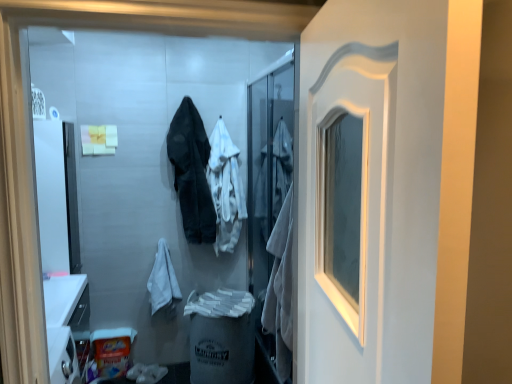
Image resolution: width=512 pixels, height=384 pixels. Find the location of `dark gray fabric coat at center, positioned as the first clothing in left-to-right order`. dark gray fabric coat at center, positioned as the first clothing in left-to-right order is located at coordinates (192, 172).

At what (x,y) coordinates should I click in order to perform the action: click on white matte screen door at center. Please return your answer as a coordinate pair (x, y). Looking at the image, I should click on (270, 205).

The height and width of the screenshot is (384, 512). I want to click on white cotton bathrobe at lower left, so click(x=163, y=282).

You are a GUI agent. You are given a task and a screenshot of the screen. Output one action in this format:
    pyautogui.click(x=<x>, y=<y>)
    Task: Click on the white cotton hoodie at center, the 2th clothing from the left
    This screenshot has height=384, width=512.
    Given the screenshot: What is the action you would take?
    pyautogui.click(x=225, y=188)

Which object is more forward, white cotton bathrobe at lower left or white matte screen door at center?

white matte screen door at center is more forward.

Does point (166, 245) come closer to viewer compared to point (278, 257)?

No, (166, 245) is further to viewer.

Is white cotton bathrobe at lower left completely or partially outside of white matte screen door at center?

white cotton bathrobe at lower left lies outside white matte screen door at center's area.

How different are the orientations of white cotton bathrobe at lower left and white matte screen door at center in degrees?

white cotton bathrobe at lower left and white matte screen door at center are facing 93.5 degrees away from each other.

Does white cotton hoodie at center, the first clothing when ordered from right to left, have a lesser height compared to white cotton bathrobe at lower left?

No, white cotton hoodie at center, the first clothing when ordered from right to left, is not shorter than white cotton bathrobe at lower left.

Is white cotton hoodie at center, the 2th clothing from the left, far from white cotton bathrobe at lower left?

Actually, white cotton hoodie at center, the 2th clothing from the left, and white cotton bathrobe at lower left are a little close together.

From a real-world perspective, which is physically above, white cotton hoodie at center, the first clothing when ordered from right to left, or white cotton bathrobe at lower left?

white cotton hoodie at center, the first clothing when ordered from right to left, is physically above.

From the image's perspective, is white glossy door at center over white cotton hoodie at center, the first clothing when ordered from right to left?

No, from the image's perspective, white glossy door at center is not on top of white cotton hoodie at center, the first clothing when ordered from right to left.

Is white glossy door at center oriented towards white cotton hoodie at center, the 2th clothing from the left?

No, white glossy door at center is not facing towards white cotton hoodie at center, the 2th clothing from the left.

Does white glossy door at center contain white cotton hoodie at center, the 2th clothing from the left?

No, white cotton hoodie at center, the 2th clothing from the left, is not surrounded by white glossy door at center.

Considering the sizes of objects white glossy door at center and white cotton hoodie at center, the 2th clothing from the left, in the image provided, who is thinner, white glossy door at center or white cotton hoodie at center, the 2th clothing from the left,?

white glossy door at center.

Considering the sizes of dark gray fabric coat at center, positioned as the first clothing in left-to-right order, and white glossy door at center in the image, is dark gray fabric coat at center, positioned as the first clothing in left-to-right order, bigger or smaller than white glossy door at center?

Clearly, dark gray fabric coat at center, positioned as the first clothing in left-to-right order, is larger in size than white glossy door at center.

Is dark gray fabric coat at center, the second clothing positioned from the right, inside or outside of white glossy door at center?

dark gray fabric coat at center, the second clothing positioned from the right, cannot be found inside white glossy door at center.

Is dark gray fabric coat at center, the second clothing positioned from the right, shorter than white glossy door at center?

Yes, dark gray fabric coat at center, the second clothing positioned from the right, is shorter than white glossy door at center.

Looking at their sizes, would you say dark gray fabric coat at center, positioned as the first clothing in left-to-right order, is wider or thinner than white glossy door at center?

Considering their sizes, dark gray fabric coat at center, positioned as the first clothing in left-to-right order, looks broader than white glossy door at center.

Is white cotton bathrobe at lower left taller than white cotton hoodie at center, the 2th clothing from the left?

No.

Based on their positions, is white cotton bathrobe at lower left located to the left or right of white cotton hoodie at center, the 2th clothing from the left?

From the image, it's evident that white cotton bathrobe at lower left is to the left of white cotton hoodie at center, the 2th clothing from the left.

Is white cotton bathrobe at lower left oriented towards white cotton hoodie at center, the first clothing when ordered from right to left?

No.

From a real-world perspective, who is located lower, white cotton bathrobe at lower left or white cotton hoodie at center, the first clothing when ordered from right to left?

white cotton bathrobe at lower left.

Between white cotton hoodie at center, the 2th clothing from the left, and white matte screen door at center, which one has smaller size?

With smaller size is white cotton hoodie at center, the 2th clothing from the left.

How far apart are white cotton hoodie at center, the 2th clothing from the left, and white matte screen door at center?

A distance of 16.10 inches exists between white cotton hoodie at center, the 2th clothing from the left, and white matte screen door at center.

Considering the relative positions of white cotton hoodie at center, the first clothing when ordered from right to left, and white matte screen door at center in the image provided, is white cotton hoodie at center, the first clothing when ordered from right to left, behind white matte screen door at center?

Yes, the depth of white cotton hoodie at center, the first clothing when ordered from right to left, is greater than that of white matte screen door at center.

Considering the positions of objects white cotton hoodie at center, the first clothing when ordered from right to left, and white matte screen door at center in the image provided, who is more to the right, white cotton hoodie at center, the first clothing when ordered from right to left, or white matte screen door at center?

white matte screen door at center is more to the right.

Is white matte screen door at center not close to dark gray fabric coat at center, the second clothing positioned from the right?

white matte screen door at center is near dark gray fabric coat at center, the second clothing positioned from the right, not far away.

Image resolution: width=512 pixels, height=384 pixels. I want to click on screen door on the right of dark gray fabric coat at center, positioned as the first clothing in left-to-right order, so click(x=270, y=205).

From a real-world perspective, which is physically below, white matte screen door at center or dark gray fabric coat at center, positioned as the first clothing in left-to-right order?

From a 3D spatial view, white matte screen door at center is below.

The width and height of the screenshot is (512, 384). I want to click on bathrobe located underneath the white matte screen door at center (from a real-world perspective), so click(163, 282).

Identify the location of bathrobe below the white cotton hoodie at center, the 2th clothing from the left (from the image's perspective). (163, 282).

Estimate the real-world distances between objects in this image. Which object is closer to white cotton bathrobe at lower left, white matte screen door at center or white cotton hoodie at center, the 2th clothing from the left?

Based on the image, white cotton hoodie at center, the 2th clothing from the left, appears to be nearer to white cotton bathrobe at lower left.

From the image, which object appears to be farther from white cotton hoodie at center, the first clothing when ordered from right to left, white cotton bathrobe at lower left or dark gray fabric coat at center, positioned as the first clothing in left-to-right order?

Based on the image, white cotton bathrobe at lower left appears to be further to white cotton hoodie at center, the first clothing when ordered from right to left.

Based on their spatial positions, is white matte screen door at center or white glossy door at center closer to white cotton bathrobe at lower left?

white matte screen door at center is positioned closer to the anchor white cotton bathrobe at lower left.

Looking at the image, which one is located further to white glossy door at center, white matte screen door at center or white cotton bathrobe at lower left?

Among the two, white cotton bathrobe at lower left is located further to white glossy door at center.

When comparing their distances from white cotton hoodie at center, the first clothing when ordered from right to left, does white matte screen door at center or dark gray fabric coat at center, the second clothing positioned from the right, seem further?

Among the two, white matte screen door at center is located further to white cotton hoodie at center, the first clothing when ordered from right to left.

Considering their positions, is white matte screen door at center positioned closer to white glossy door at center than dark gray fabric coat at center, the second clothing positioned from the right?

Based on the image, white matte screen door at center appears to be nearer to white glossy door at center.

Which object lies nearer to the anchor point white matte screen door at center, white glossy door at center or white cotton bathrobe at lower left?

Among the two, white cotton bathrobe at lower left is located nearer to white matte screen door at center.

Estimate the real-world distances between objects in this image. Which object is closer to white matte screen door at center, white cotton hoodie at center, the first clothing when ordered from right to left, or dark gray fabric coat at center, the second clothing positioned from the right?

white cotton hoodie at center, the first clothing when ordered from right to left, is positioned closer to the anchor white matte screen door at center.

Where is `bathrobe located between white matte screen door at center and white cotton hoodie at center, the first clothing when ordered from right to left, in the depth direction`? The width and height of the screenshot is (512, 384). bathrobe located between white matte screen door at center and white cotton hoodie at center, the first clothing when ordered from right to left, in the depth direction is located at coordinates (163, 282).

This screenshot has height=384, width=512. I want to click on screen door located between white glossy door at center and white cotton bathrobe at lower left in the depth direction, so click(270, 205).

At what (x,y) coordinates should I click in order to perform the action: click on clothing between white matte screen door at center and white cotton hoodie at center, the 2th clothing from the left, in the front-back direction. Please return your answer as a coordinate pair (x, y). Image resolution: width=512 pixels, height=384 pixels. Looking at the image, I should click on (192, 172).

What are the coordinates of `clothing between white matte screen door at center and white cotton bathrobe at lower left along the z-axis` in the screenshot? It's located at (192, 172).